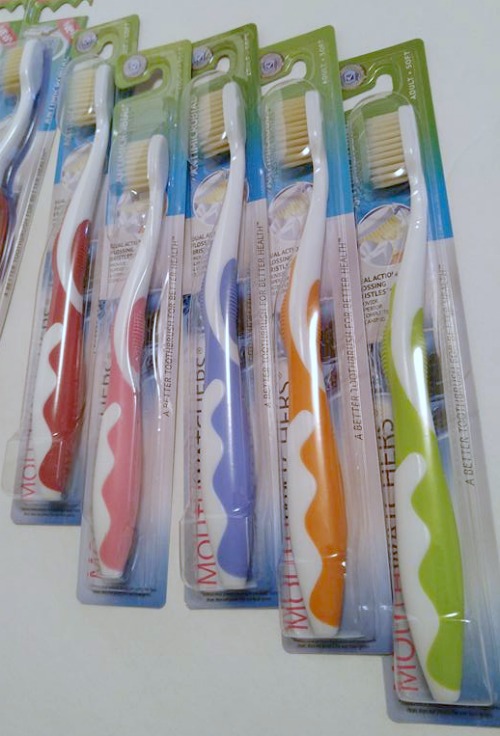
Find the location of a particular element. This screenshot has height=736, width=500. table is located at coordinates (448, 32), (95, 701), (9, 15).